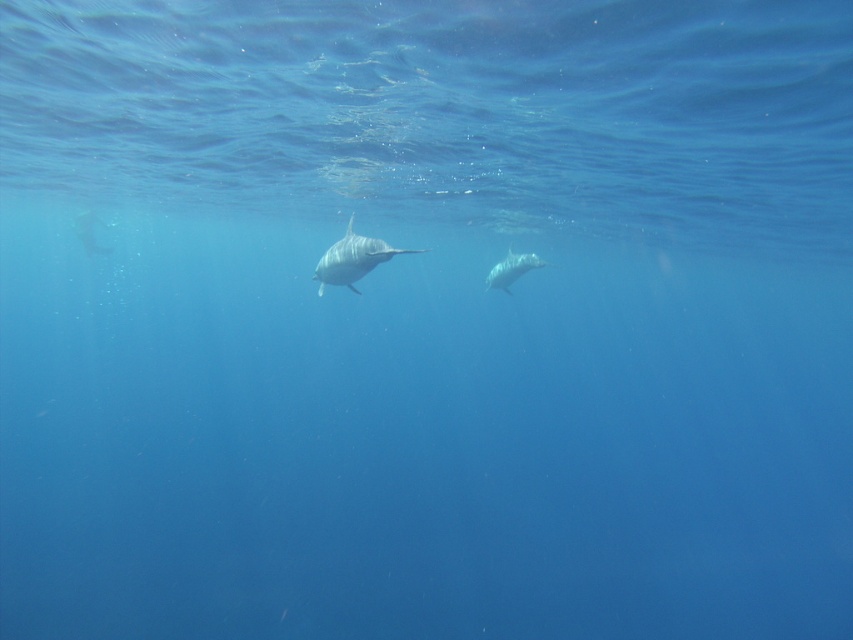
Question: Can you confirm if smooth gray dolphin at center is thinner than white smooth dolphin at center?

Choices:
 (A) yes
 (B) no

Answer: (B)

Question: From the image, what is the correct spatial relationship of smooth gray dolphin at center in relation to white smooth dolphin at center?

Choices:
 (A) right
 (B) left

Answer: (B)

Question: Does smooth gray dolphin at center appear on the left side of white smooth dolphin at center?

Choices:
 (A) yes
 (B) no

Answer: (A)

Question: Which object appears farthest from the camera in this image?

Choices:
 (A) white smooth dolphin at center
 (B) smooth gray dolphin at center

Answer: (A)

Question: Which point is closer to the camera?

Choices:
 (A) smooth gray dolphin at center
 (B) white smooth dolphin at center

Answer: (A)